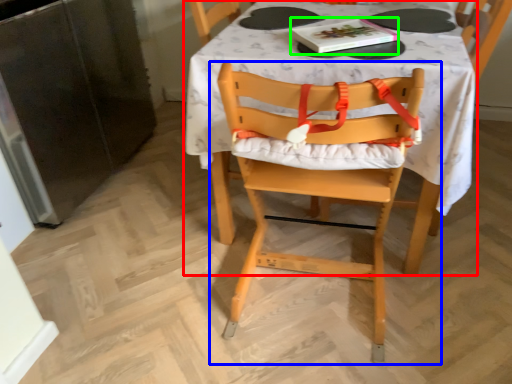
Question: Which object is positioned farthest from table (highlighted by a red box)? Select from chair (highlighted by a blue box) and book (highlighted by a green box).

Choices:
 (A) chair
 (B) book

Answer: (B)